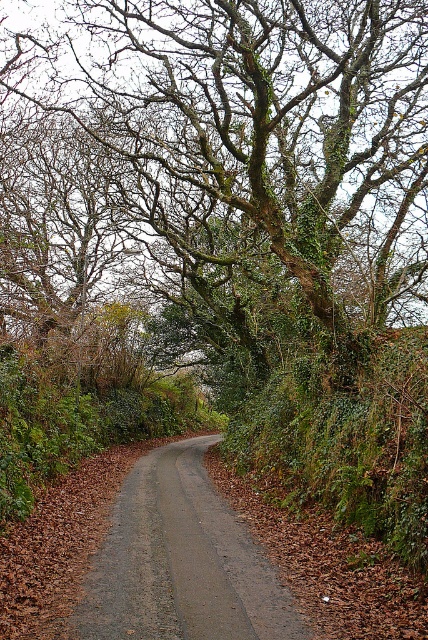
Question: Among these points, which one is farthest from the camera?

Choices:
 (A) (214, 563)
 (B) (272, 326)

Answer: (B)

Question: In this image, where is green mossy tree at upper center located relative to gray gravel road at center?

Choices:
 (A) above
 (B) below

Answer: (A)

Question: Which point is closer to the camera taking this photo?

Choices:
 (A) (306, 35)
 (B) (205, 564)

Answer: (B)

Question: Does green mossy tree at upper center appear on the left side of gray gravel road at center?

Choices:
 (A) no
 (B) yes

Answer: (B)

Question: Is green mossy tree at upper center bigger than gray gravel road at center?

Choices:
 (A) no
 (B) yes

Answer: (B)